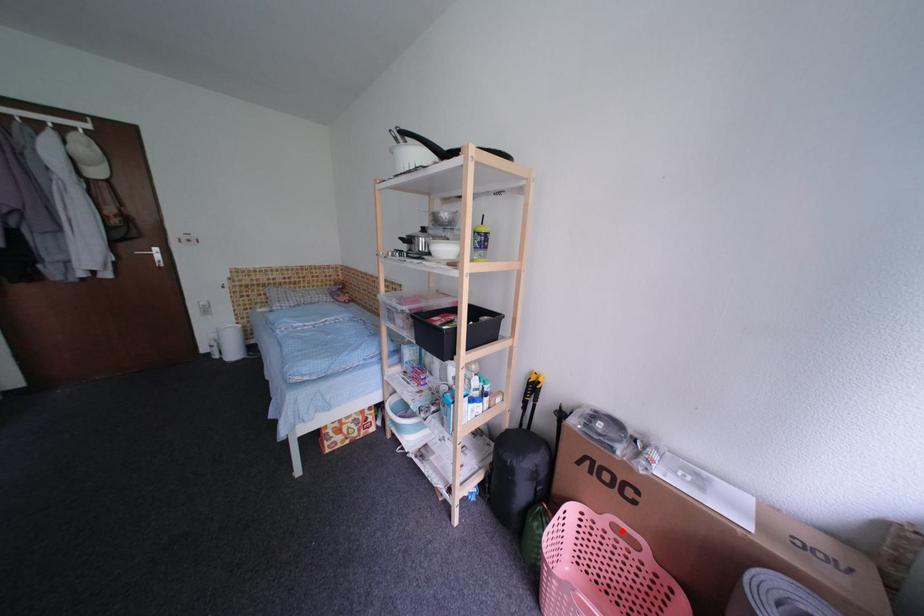
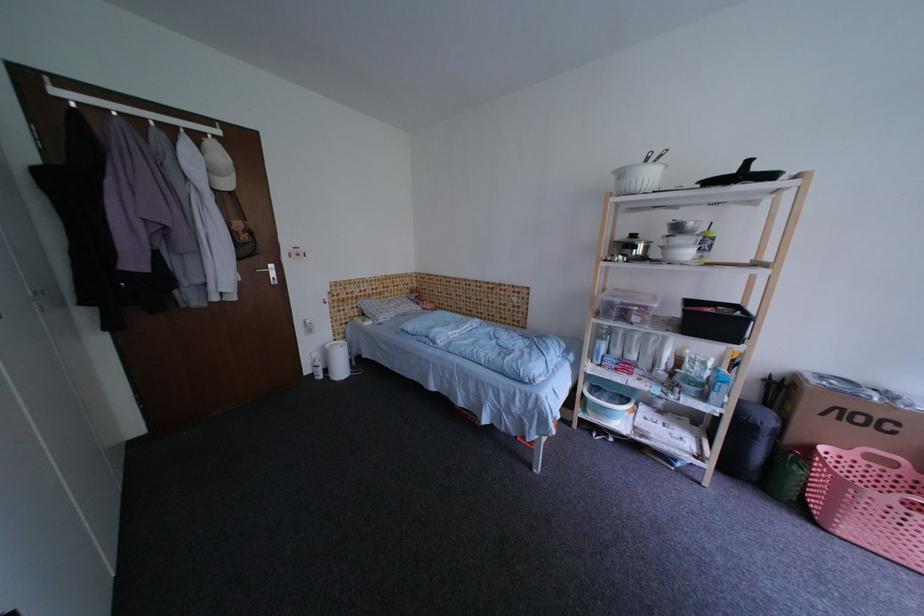
Question: A red point is marked in image1. In image2, is the corresponding 3D point closer to the camera or farther? Reply with the corresponding letter.

Choices:
 (A) The corresponding 3D point is closer.
 (B) The corresponding 3D point is farther.

Answer: (B)